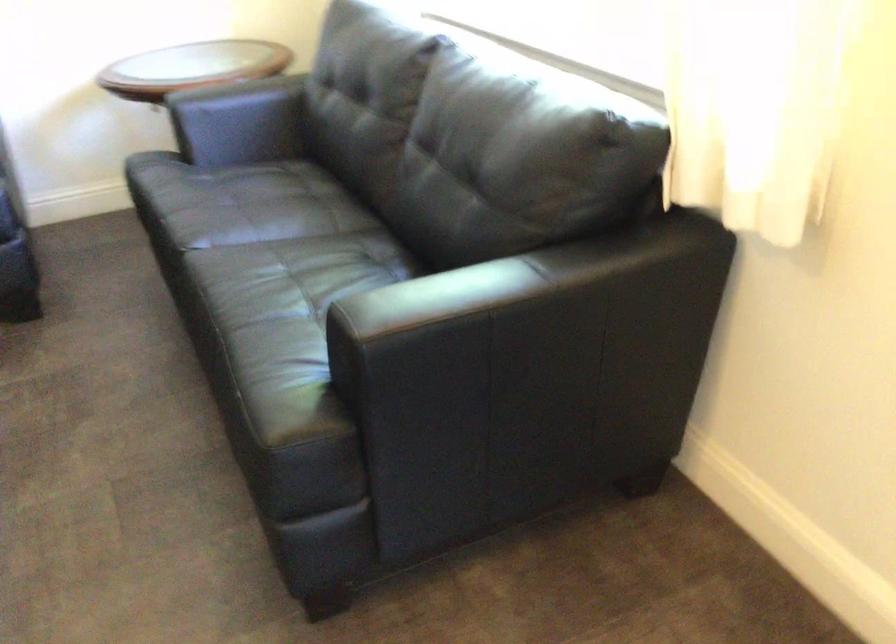
Where would you sit the black sofa sitting surface? Please return your answer as a coordinate pair (x, y).

(259, 276)